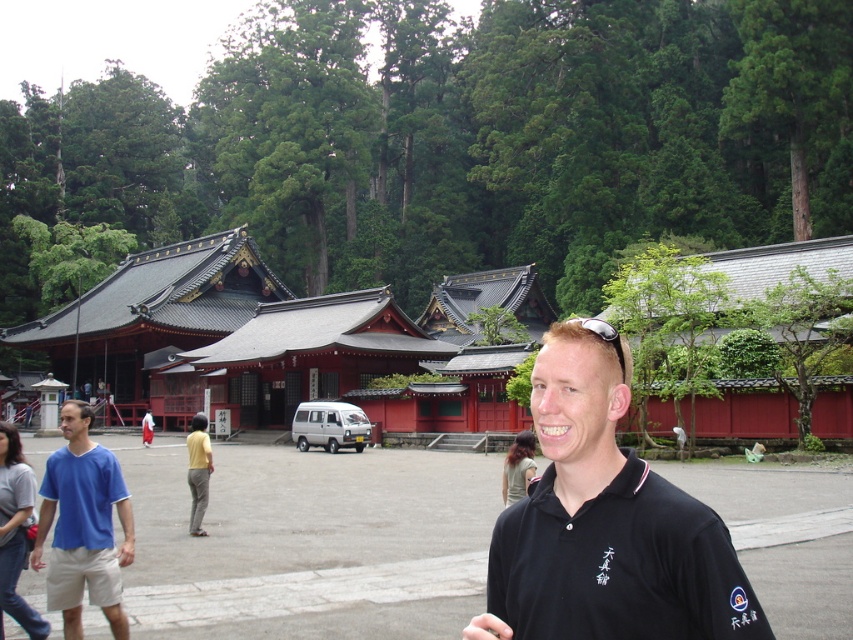
Is black cotton shirt at center wider than blue cotton shirt at left?

Yes.

Who is taller, black cotton shirt at center or blue cotton shirt at left?

black cotton shirt at center is taller.

What do you see at coordinates (606, 522) in the screenshot? This screenshot has width=853, height=640. I see `black cotton shirt at center` at bounding box center [606, 522].

The width and height of the screenshot is (853, 640). Find the location of `black cotton shirt at center`. black cotton shirt at center is located at coordinates (606, 522).

Is black cotton shirt at center below matte blue polo shirt at left?

Correct, black cotton shirt at center is located below matte blue polo shirt at left.

Is point (631, 474) positioned after point (103, 449)?

No, (631, 474) is in front of (103, 449).

Image resolution: width=853 pixels, height=640 pixels. In order to click on black cotton shirt at center in this screenshot , I will do `click(606, 522)`.

Is point (57, 483) closer to viewer compared to point (85, 484)?

That is False.

Between blue cotton shirt at left and matte blue polo shirt at left, which one appears on the right side from the viewer's perspective?

blue cotton shirt at left

What do you see at coordinates (84, 522) in the screenshot? I see `blue cotton shirt at left` at bounding box center [84, 522].

Locate an element on the screen. Image resolution: width=853 pixels, height=640 pixels. blue cotton shirt at left is located at coordinates (84, 522).